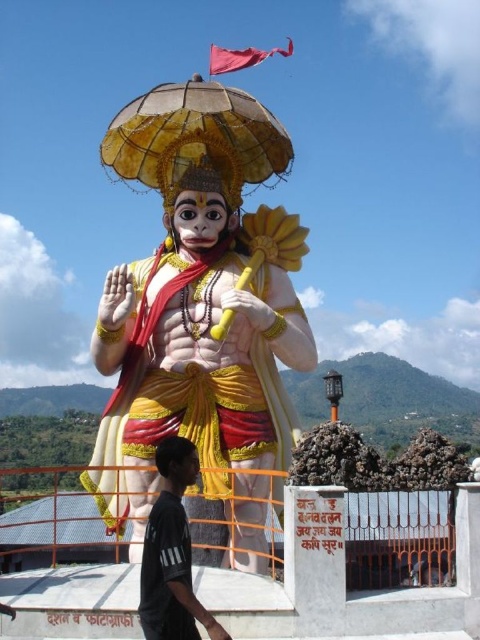
Does polished gold statue at center appear over gold textured umbrella at center?

Actually, polished gold statue at center is below gold textured umbrella at center.

Does polished gold statue at center appear on the right side of gold textured umbrella at center?

Correct, you'll find polished gold statue at center to the right of gold textured umbrella at center.

Where is `polished gold statue at center`? polished gold statue at center is located at coordinates (202, 314).

Can you confirm if polished gold statue at center is positioned to the right of black cotton shirt at lower left?

Indeed, polished gold statue at center is positioned on the right side of black cotton shirt at lower left.

Is point (267, 240) positioned before point (176, 618)?

No, it is not.

At what (x,y) coordinates should I click in order to perform the action: click on polished gold statue at center. Please return your answer as a coordinate pair (x, y). Looking at the image, I should click on (202, 314).

Based on the photo, who is more distant from viewer, (251,144) or (172,572)?

Positioned behind is point (251,144).

Can you confirm if gold textured umbrella at center is positioned to the right of black cotton shirt at lower left?

In fact, gold textured umbrella at center is to the left of black cotton shirt at lower left.

What do you see at coordinates (195, 140) in the screenshot? I see `gold textured umbrella at center` at bounding box center [195, 140].

This screenshot has width=480, height=640. Find the location of `gold textured umbrella at center`. gold textured umbrella at center is located at coordinates (195, 140).